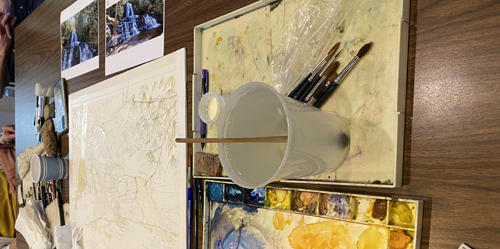
Locate an element on the screen. artwork is located at coordinates (141, 184).